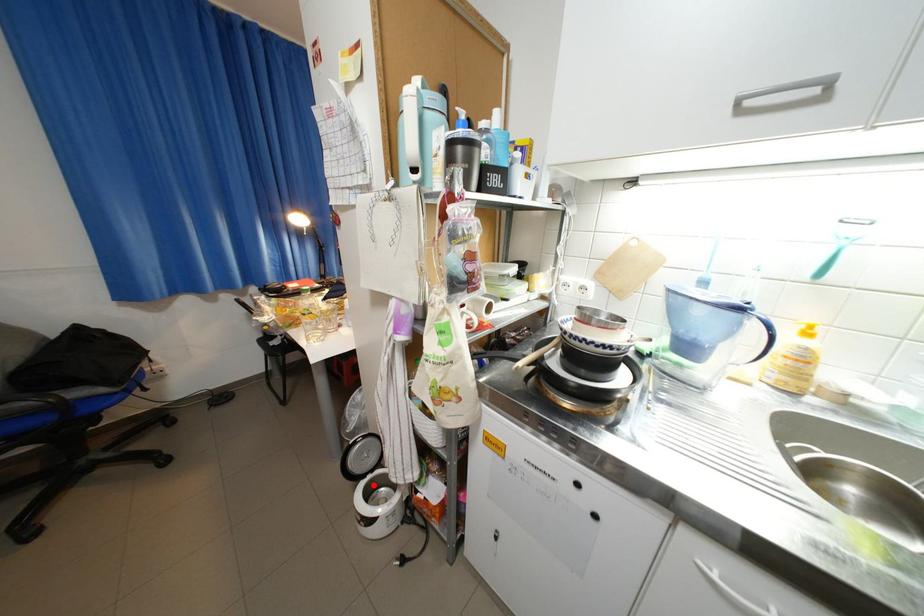
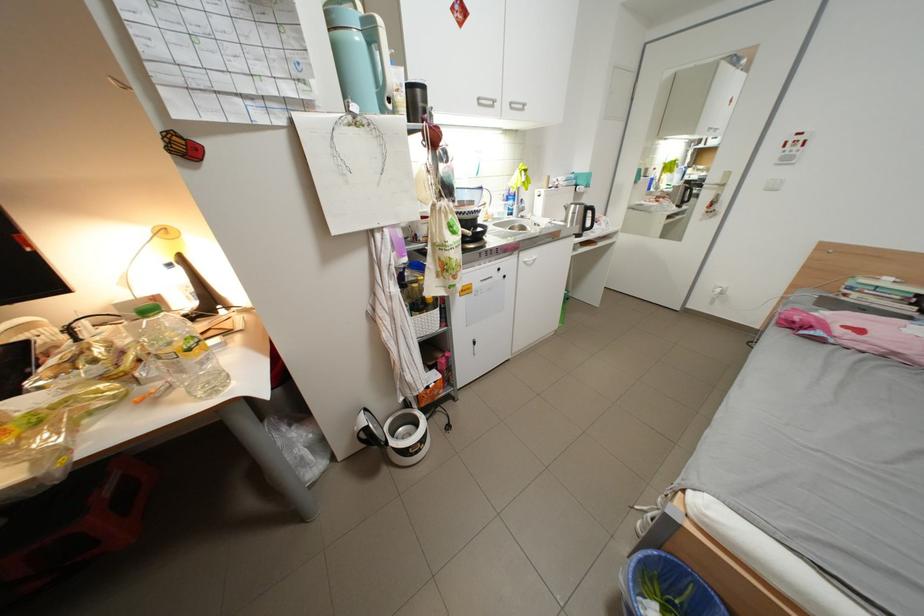
Locate, in the second image, the point that corresponds to the highlighted location in the first image.

(404, 444)